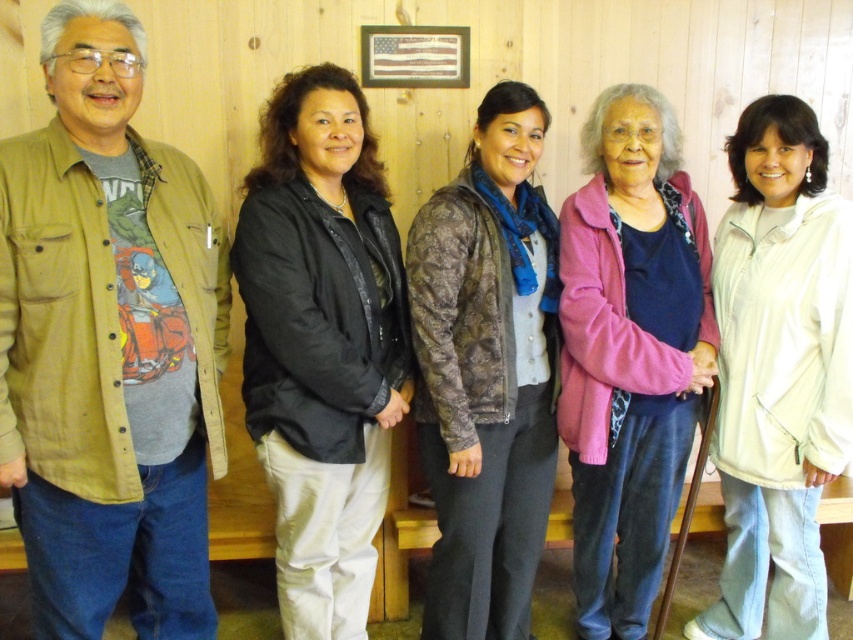
Who is more forward, (347, 403) or (514, 244)?

Point (347, 403) is more forward.

Does point (379, 364) come closer to viewer compared to point (502, 371)?

No, it is behind (502, 371).

Locate an element on the screen. This screenshot has height=640, width=853. black leather jacket at center is located at coordinates (321, 342).

Does brown quilted jacket at center have a greater width compared to pink fabric jacket at center?

In fact, brown quilted jacket at center might be narrower than pink fabric jacket at center.

Can you confirm if brown quilted jacket at center is positioned to the left of pink fabric jacket at center?

Yes, brown quilted jacket at center is to the left of pink fabric jacket at center.

Is point (482, 225) positioned before point (608, 161)?

Yes, it is.

This screenshot has width=853, height=640. Identify the location of brown quilted jacket at center. (486, 371).

Which of these two, pink fabric jacket at center or white matte jacket at center, stands shorter?

With less height is white matte jacket at center.

Can you confirm if pink fabric jacket at center is shorter than white matte jacket at center?

Result: No.

Who is more distant from viewer, [631,104] or [776,428]?

The point [631,104] is more distant.

Where is `pink fabric jacket at center`? The height and width of the screenshot is (640, 853). pink fabric jacket at center is located at coordinates (630, 353).